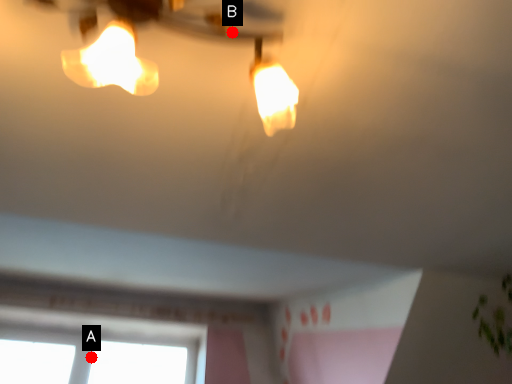
Question: Two points are circled on the image, labeled by A and B beside each circle. Which point is farther to the camera?

Choices:
 (A) A is further
 (B) B is further

Answer: (A)